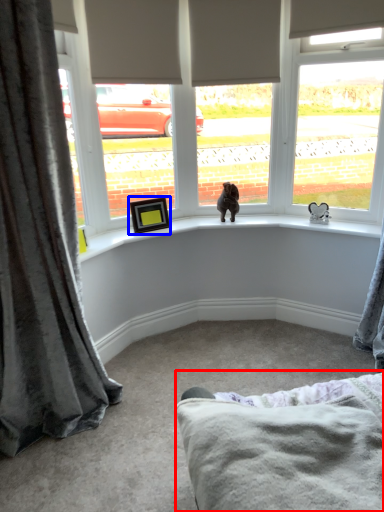
Question: Which object is closer to the camera taking this photo, bedding (highlighted by a red box) or picture frame (highlighted by a blue box)?

Choices:
 (A) bedding
 (B) picture frame

Answer: (A)